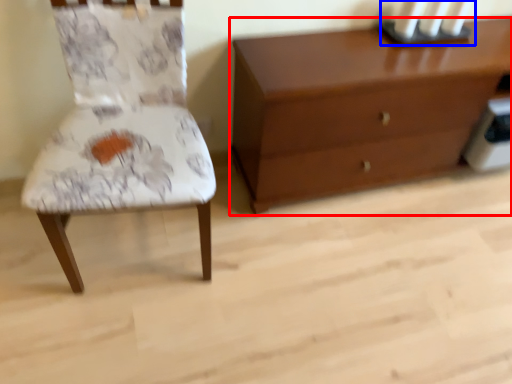
Question: Among these objects, which one is farthest to the camera, chest of drawers (highlighted by a red box) or candle holder (highlighted by a blue box)?

Choices:
 (A) chest of drawers
 (B) candle holder

Answer: (B)